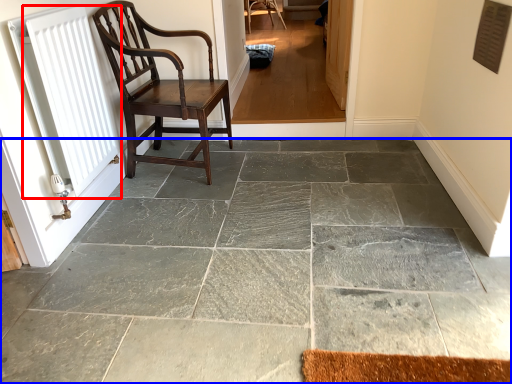
Question: Which point is closer to the camera, radiator (highlighted by a red box) or concrete (highlighted by a blue box)?

Choices:
 (A) radiator
 (B) concrete

Answer: (B)